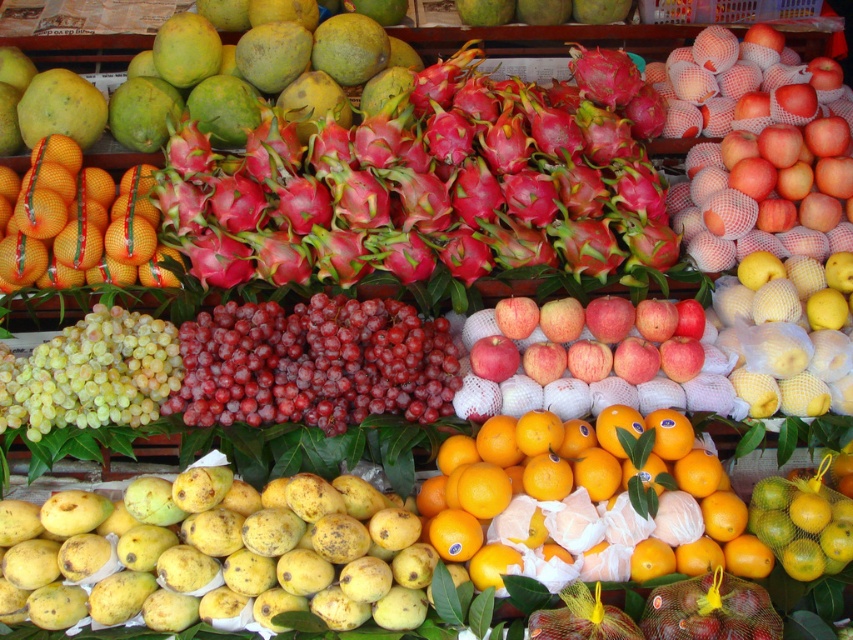
Does red matte dragonfruit at center appear under red matte apples at center?

Incorrect, red matte dragonfruit at center is not positioned below red matte apples at center.

Locate an element on the screen. red matte dragonfruit at center is located at coordinates (427, 184).

Based on the photo, measure the distance between point (396, 186) and camera.

Point (396, 186) and camera are 2.55 meters apart from each other.

Image resolution: width=853 pixels, height=640 pixels. Find the location of `red matte dragonfruit at center`. red matte dragonfruit at center is located at coordinates (427, 184).

Between orangesmoothorange at center and red matte apples at center, which one has less height?

Standing shorter between the two is red matte apples at center.

Consider the image. Is orangesmoothorange at center bigger than red matte apples at center?

Indeed, orangesmoothorange at center has a larger size compared to red matte apples at center.

Where is `orangesmoothorange at center`? orangesmoothorange at center is located at coordinates (589, 500).

This screenshot has width=853, height=640. Find the location of `orangesmoothorange at center`. orangesmoothorange at center is located at coordinates pos(589,500).

Based on the photo, who is positioned more to the left, red matte dragonfruit at center or yellow matte mango at lower left?

Positioned to the left is yellow matte mango at lower left.

Can you confirm if red matte dragonfruit at center is taller than yellow matte mango at lower left?

Yes, red matte dragonfruit at center is taller than yellow matte mango at lower left.

The width and height of the screenshot is (853, 640). In order to click on red matte dragonfruit at center in this screenshot , I will do `click(427, 184)`.